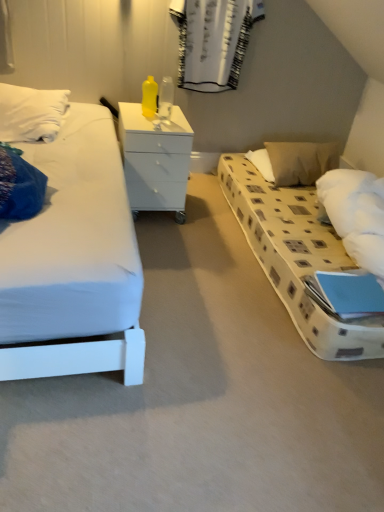
This screenshot has width=384, height=512. In order to click on white glossy chest of drawers at center in this screenshot , I will do `click(155, 160)`.

The width and height of the screenshot is (384, 512). I want to click on pillow beneath the white textured curtain at upper center (from a real-world perspective), so click(301, 161).

From the image's perspective, between beige fabric pillow at right and white textured curtain at upper center, who is located below?

beige fabric pillow at right appears lower in the image.

Could you tell me if beige fabric pillow at right is facing white textured curtain at upper center?

No, beige fabric pillow at right is not facing towards white textured curtain at upper center.

Based on the photo, measure the distance between beige fabric pillow at right and white textured curtain at upper center.

beige fabric pillow at right is 29.95 inches from white textured curtain at upper center.

Is white glossy chest of drawers at center with beige fabric pillow at right?

white glossy chest of drawers at center and beige fabric pillow at right are not in contact.

Locate an element on the screen. chest of drawers below the beige fabric pillow at right (from the image's perspective) is located at coordinates (155, 160).

Which point is more distant from viewer, (148, 141) or (281, 181)?

The point (281, 181) is more distant.

Could you tell me if white glossy chest of drawers at center is facing beige fabric pillow at right?

No, white glossy chest of drawers at center is not turned towards beige fabric pillow at right.

Which of these two, white textured curtain at upper center or white glossy chest of drawers at center, stands shorter?

With less height is white glossy chest of drawers at center.

At what (x,y) coordinates should I click in order to perform the action: click on curtain above the white glossy chest of drawers at center (from the image's perspective). Please return your answer as a coordinate pair (x, y). Looking at the image, I should click on (213, 41).

From the image's perspective, between white textured curtain at upper center and white glossy chest of drawers at center, which one is located above?

white textured curtain at upper center appears higher in the image.

Is white textured curtain at upper center looking in the opposite direction of white glossy chest of drawers at center?

white textured curtain at upper center is not turned away from white glossy chest of drawers at center.

Is beige fabric pillow at right looking in the opposite direction of white glossy chest of drawers at center?

No, beige fabric pillow at right's orientation is not away from white glossy chest of drawers at center.

Is beige fabric pillow at right bigger than white glossy chest of drawers at center?

Actually, beige fabric pillow at right might be smaller than white glossy chest of drawers at center.

Considering their positions, is beige fabric pillow at right located in front of or behind white glossy chest of drawers at center?

Clearly, beige fabric pillow at right is behind white glossy chest of drawers at center.

Would you say beige fabric pillow at right is outside white glossy chest of drawers at center?

beige fabric pillow at right is positioned outside white glossy chest of drawers at center.

Would you say white glossy chest of drawers at center is a long distance from white textured curtain at upper center?

That's not correct — white glossy chest of drawers at center is a little close to white textured curtain at upper center.

Considering the relative sizes of white glossy chest of drawers at center and white textured curtain at upper center in the image provided, is white glossy chest of drawers at center shorter than white textured curtain at upper center?

Correct, white glossy chest of drawers at center is not as tall as white textured curtain at upper center.

Is white glossy chest of drawers at center inside or outside of white textured curtain at upper center?

white glossy chest of drawers at center cannot be found inside white textured curtain at upper center.

Is white glossy chest of drawers at center further to camera compared to white textured curtain at upper center?

No, white glossy chest of drawers at center is in front of white textured curtain at upper center.

Considering the sizes of objects white textured curtain at upper center and beige fabric pillow at right in the image provided, who is bigger, white textured curtain at upper center or beige fabric pillow at right?

With larger size is beige fabric pillow at right.

Is white textured curtain at upper center thinner than beige fabric pillow at right?

Indeed, white textured curtain at upper center has a lesser width compared to beige fabric pillow at right.

Is white textured curtain at upper center positioned beyond the bounds of beige fabric pillow at right?

Yes, white textured curtain at upper center is located beyond the bounds of beige fabric pillow at right.

Between white textured curtain at upper center and beige fabric pillow at right, which one appears on the left side from the viewer's perspective?

white textured curtain at upper center.

This screenshot has height=512, width=384. Identify the location of pillow located on the right of white textured curtain at upper center. (301, 161).

You are a GUI agent. You are given a task and a screenshot of the screen. Output one action in this format:
    pyautogui.click(x=<x>, y=<y>)
    Task: Click on the pillow below the white glossy chest of drawers at center (from a real-world perspective)
    
    Given the screenshot: What is the action you would take?
    pyautogui.click(x=301, y=161)

Considering their positions, is white glossy chest of drawers at center positioned closer to beige fabric pillow at right than white textured curtain at upper center?

Based on the image, white textured curtain at upper center appears to be nearer to beige fabric pillow at right.

Looking at the image, which one is located further to white glossy chest of drawers at center, white textured curtain at upper center or beige fabric pillow at right?

The object further to white glossy chest of drawers at center is beige fabric pillow at right.

Considering their positions, is white textured curtain at upper center positioned closer to beige fabric pillow at right than white glossy chest of drawers at center?

Based on the image, white textured curtain at upper center appears to be nearer to beige fabric pillow at right.

From the image, which object appears to be farther from white textured curtain at upper center, white glossy chest of drawers at center or beige fabric pillow at right?

The object further to white textured curtain at upper center is white glossy chest of drawers at center.

Estimate the real-world distances between objects in this image. Which object is further from white textured curtain at upper center, beige fabric pillow at right or white glossy chest of drawers at center?

white glossy chest of drawers at center lies further to white textured curtain at upper center than the other object.

Estimate the real-world distances between objects in this image. Which object is further from white glossy chest of drawers at center, beige fabric pillow at right or white textured curtain at upper center?

Among the two, beige fabric pillow at right is located further to white glossy chest of drawers at center.

You are a GUI agent. You are given a task and a screenshot of the screen. Output one action in this format:
    pyautogui.click(x=<x>, y=<y>)
    Task: Click on the curtain between white glossy chest of drawers at center and beige fabric pillow at right in the horizontal direction
    
    Given the screenshot: What is the action you would take?
    pyautogui.click(x=213, y=41)